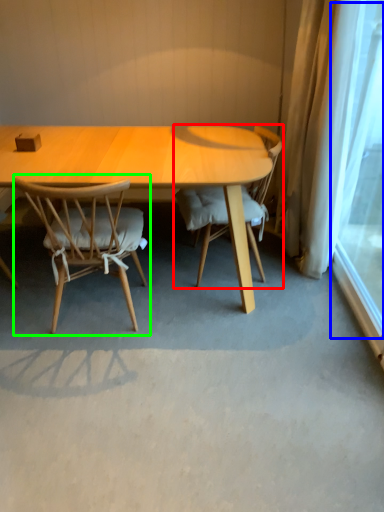
Question: Considering the real-world distances, which object is closest to chair (highlighted by a red box)? window screen (highlighted by a blue box) or chair (highlighted by a green box).

Choices:
 (A) window screen
 (B) chair

Answer: (B)